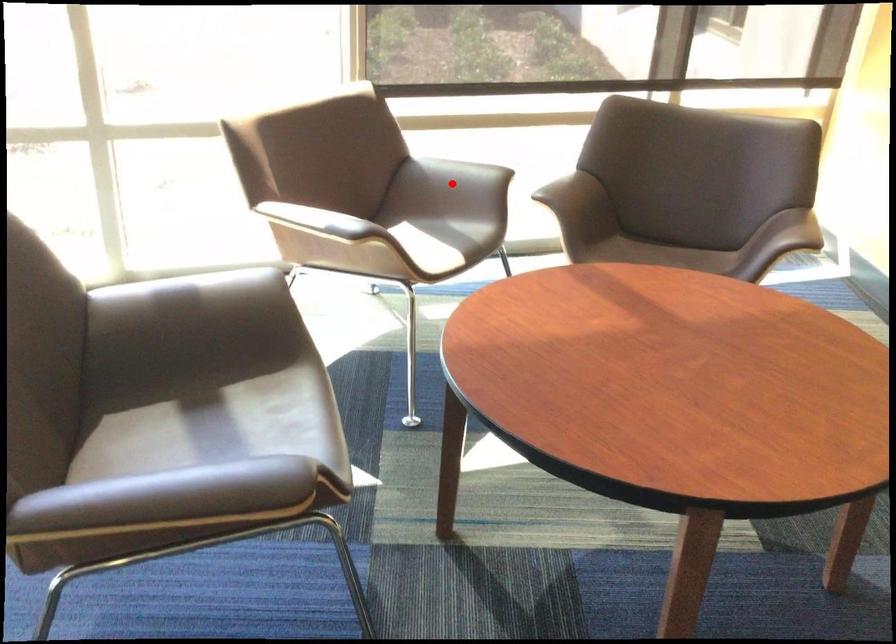
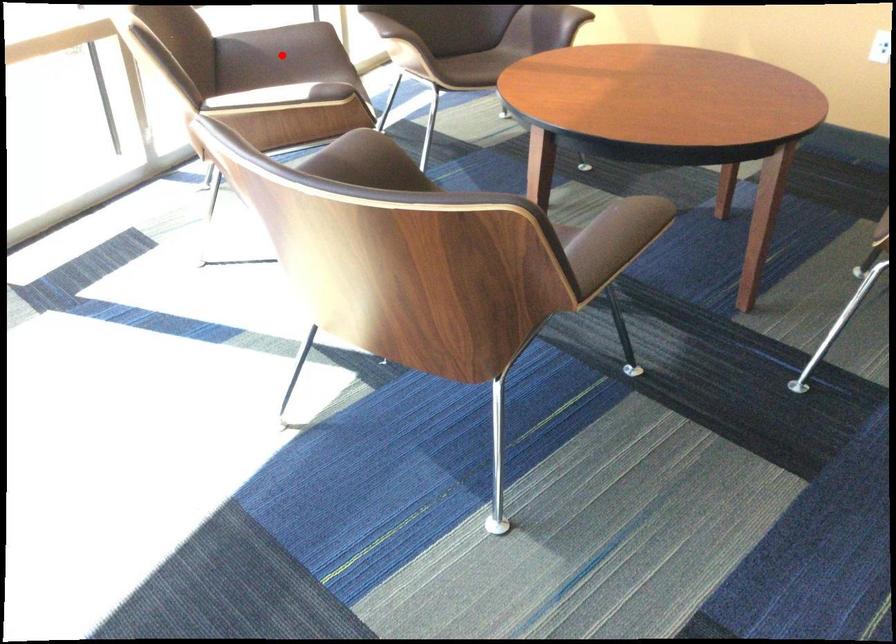
I am providing you with two images of the same scene from different viewpoints. A red point is marked on the first image and another point is marked on the second image. Do the highlighted points in image1 and image2 indicate the same real-world spot?

Yes